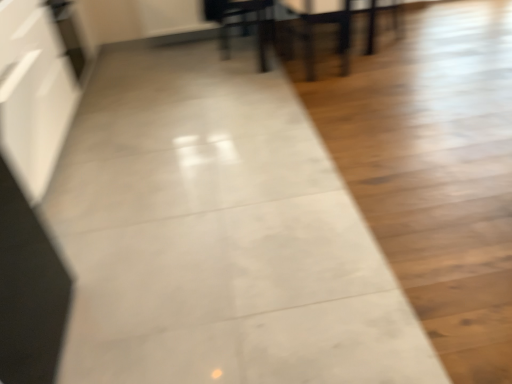
Question: From the image's perspective, is matte black chair at upper right below matte black dining chair at upper center?

Choices:
 (A) no
 (B) yes

Answer: (A)

Question: Is matte black chair at upper right at the left side of matte black dining chair at upper center?

Choices:
 (A) yes
 (B) no

Answer: (B)

Question: Can you confirm if matte black chair at upper right is thinner than matte black dining chair at upper center?

Choices:
 (A) yes
 (B) no

Answer: (A)

Question: From a real-world perspective, is matte black chair at upper right positioned over matte black dining chair at upper center based on gravity?

Choices:
 (A) no
 (B) yes

Answer: (A)

Question: From the image's perspective, is matte black chair at upper right located above matte black dining chair at upper center?

Choices:
 (A) yes
 (B) no

Answer: (A)

Question: In the image, is matte black chair at upper right positioned in front of or behind wooden table at center?

Choices:
 (A) behind
 (B) front

Answer: (A)

Question: Considering the positions of matte black chair at upper right and wooden table at center in the image, is matte black chair at upper right wider or thinner than wooden table at center?

Choices:
 (A) thin
 (B) wide

Answer: (A)

Question: Is point (397, 33) positioned closer to the camera than point (248, 1)?

Choices:
 (A) closer
 (B) farther

Answer: (B)

Question: Visually, is matte black chair at upper right positioned to the left or to the right of wooden table at center?

Choices:
 (A) right
 (B) left

Answer: (A)

Question: In terms of size, does wooden table at center appear bigger or smaller than matte black chair at upper right?

Choices:
 (A) small
 (B) big

Answer: (B)

Question: Is wooden table at center situated inside matte black chair at upper right or outside?

Choices:
 (A) outside
 (B) inside

Answer: (A)

Question: Is wooden table at center taller or shorter than matte black chair at upper right?

Choices:
 (A) short
 (B) tall

Answer: (B)

Question: From the image's perspective, relative to matte black chair at upper right, is wooden table at center above or below?

Choices:
 (A) below
 (B) above

Answer: (B)

Question: From the image's perspective, is matte black armchair at upper center located above or below wooden table at center?

Choices:
 (A) above
 (B) below

Answer: (B)

Question: Considering the relative positions of matte black armchair at upper center and wooden table at center in the image provided, is matte black armchair at upper center to the left or to the right of wooden table at center?

Choices:
 (A) left
 (B) right

Answer: (B)